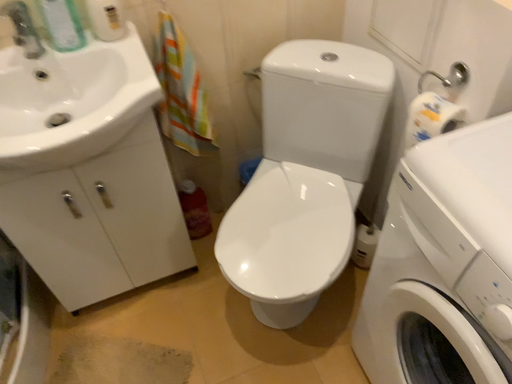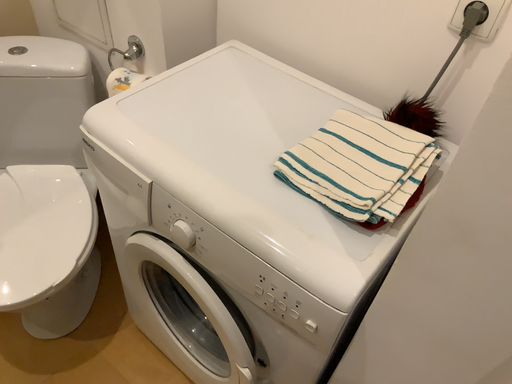
Question: Which way did the camera rotate in the video?

Choices:
 (A) rotated left
 (B) rotated right

Answer: (B)